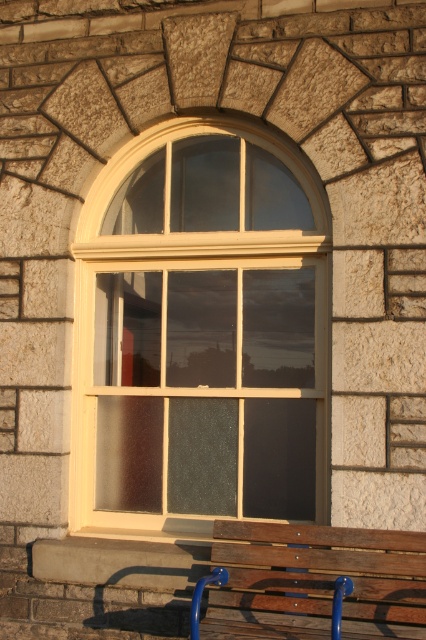
Question: Which object appears farthest from the camera in this image?

Choices:
 (A) wooden bench at lower center
 (B) matte cream window at center

Answer: (B)

Question: Does matte cream window at center have a lesser width compared to wooden bench at lower center?

Choices:
 (A) yes
 (B) no

Answer: (B)

Question: Can you confirm if matte cream window at center is positioned below wooden bench at lower center?

Choices:
 (A) no
 (B) yes

Answer: (A)

Question: Is matte cream window at center positioned before wooden bench at lower center?

Choices:
 (A) no
 (B) yes

Answer: (A)

Question: Which object is closer to the camera taking this photo?

Choices:
 (A) matte cream window at center
 (B) wooden bench at lower center

Answer: (B)